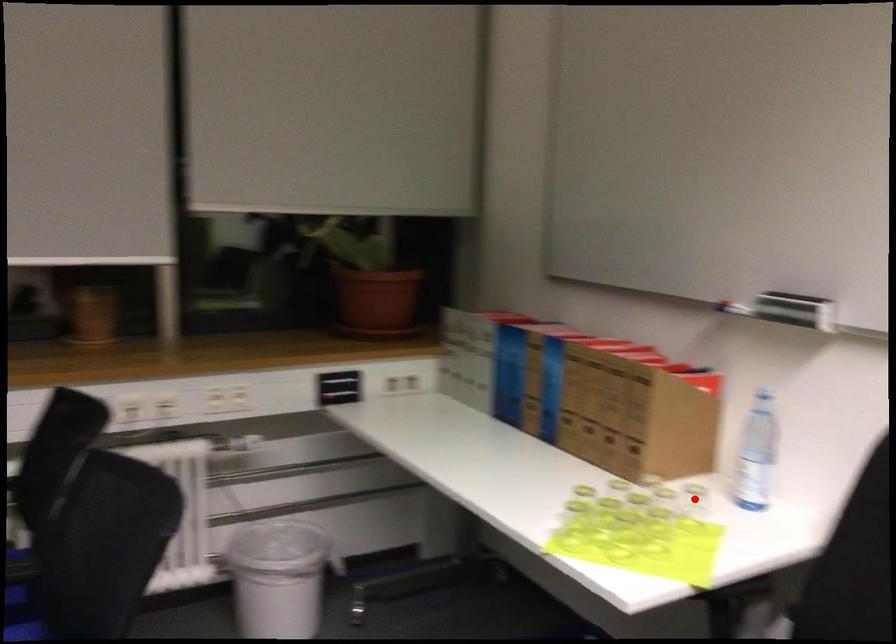
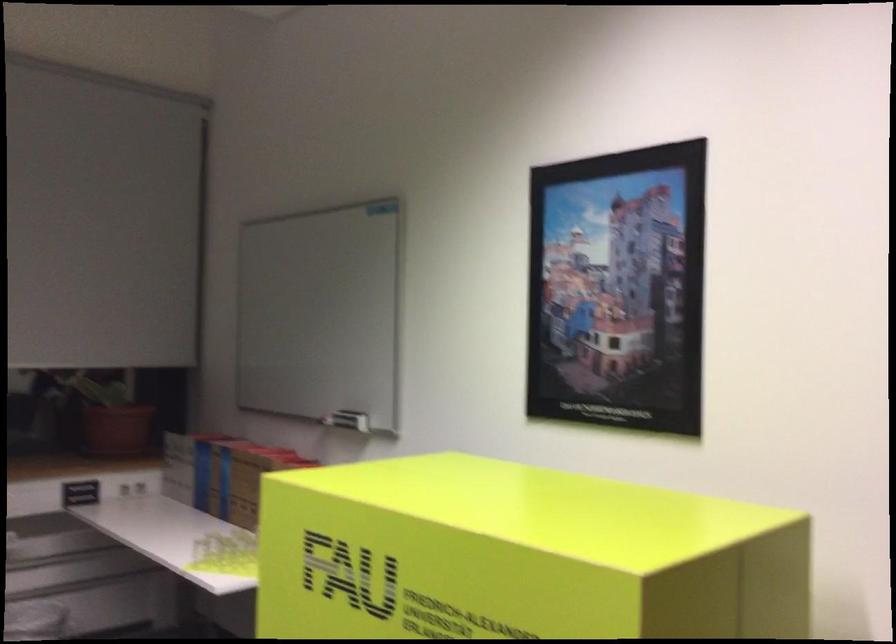
Question: I am providing you with two images of the same scene from different viewpoints. A red point is marked on the first image. Can you still see the location of the red point in image 2?

Choices:
 (A) Yes
 (B) No

Answer: (B)